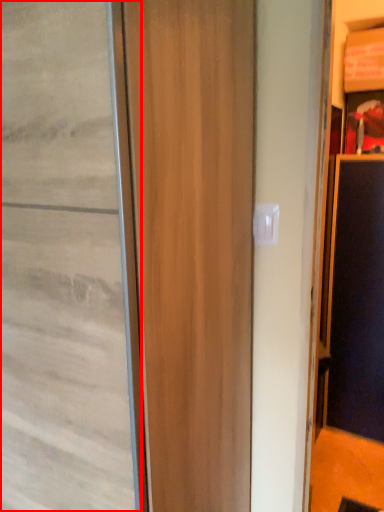
Question: From the image's perspective, considering the relative positions of door (annotated by the red box) and screen door in the image provided, where is door (annotated by the red box) located with respect to the staircase?

Choices:
 (A) below
 (B) above

Answer: (B)